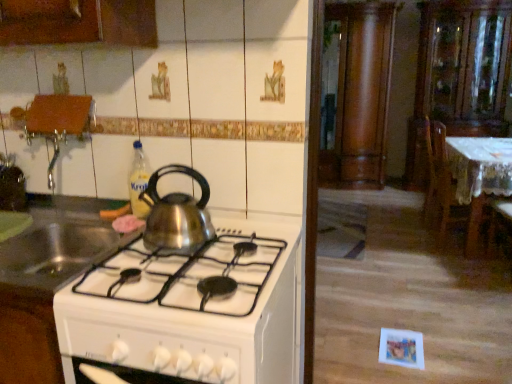
Question: Is translucent plastic bottle at upper center not inside shiny metallic kettle at center, which is the 3th kitchen appliance from left to right?

Choices:
 (A) yes
 (B) no

Answer: (A)

Question: Considering the relative positions of translucent plastic bottle at upper center and shiny metallic kettle at center, which is the 3th kitchen appliance from left to right, in the image provided, is translucent plastic bottle at upper center to the right of shiny metallic kettle at center, which is the 3th kitchen appliance from left to right, from the viewer's perspective?

Choices:
 (A) no
 (B) yes

Answer: (A)

Question: Considering the relative positions of translucent plastic bottle at upper center and shiny metallic kettle at center, which appears as the 1th kitchen appliance when viewed from the right, in the image provided, is translucent plastic bottle at upper center behind shiny metallic kettle at center, which appears as the 1th kitchen appliance when viewed from the right,?

Choices:
 (A) no
 (B) yes

Answer: (B)

Question: Is translucent plastic bottle at upper center to the left of shiny metallic kettle at center, which appears as the 1th kitchen appliance when viewed from the right, from the viewer's perspective?

Choices:
 (A) no
 (B) yes

Answer: (B)

Question: Is translucent plastic bottle at upper center facing away from shiny metallic kettle at center, which is the 3th kitchen appliance from left to right?

Choices:
 (A) yes
 (B) no

Answer: (B)

Question: Is point (473, 94) positioned closer to the camera than point (140, 152)?

Choices:
 (A) farther
 (B) closer

Answer: (A)

Question: From their relative heights in the image, would you say transparent glass cabinet at upper right, which is the 2th cabinetry in left-to-right order, is taller or shorter than translucent plastic bottle at upper center?

Choices:
 (A) short
 (B) tall

Answer: (B)

Question: Based on their positions, is transparent glass cabinet at upper right, which is the first cabinetry from right to left, located to the left or right of translucent plastic bottle at upper center?

Choices:
 (A) right
 (B) left

Answer: (A)

Question: Looking at their shapes, would you say transparent glass cabinet at upper right, which is the 2th cabinetry in left-to-right order, is wider or thinner than translucent plastic bottle at upper center?

Choices:
 (A) wide
 (B) thin

Answer: (A)

Question: Considering the relative positions of wooden column at center, which is the first cabinetry in left-to-right order, and translucent plastic bottle at upper center in the image provided, is wooden column at center, which is the first cabinetry in left-to-right order, to the left or to the right of translucent plastic bottle at upper center?

Choices:
 (A) right
 (B) left

Answer: (A)

Question: Does point (367, 173) appear closer or farther from the camera than point (147, 213)?

Choices:
 (A) farther
 (B) closer

Answer: (A)

Question: Is wooden column at center, marked as the 2th cabinetry in a right-to-left arrangement, wider or thinner than translucent plastic bottle at upper center?

Choices:
 (A) wide
 (B) thin

Answer: (A)

Question: Is wooden column at center, marked as the 2th cabinetry in a right-to-left arrangement, inside or outside of translucent plastic bottle at upper center?

Choices:
 (A) outside
 (B) inside

Answer: (A)

Question: Visually, is wooden chair at right positioned to the left or to the right of satin silver kettle at center, the 2th kitchen appliance viewed from the left?

Choices:
 (A) left
 (B) right

Answer: (B)

Question: Considering their positions, is wooden chair at right located in front of or behind satin silver kettle at center, acting as the second kitchen appliance starting from the right?

Choices:
 (A) front
 (B) behind

Answer: (B)